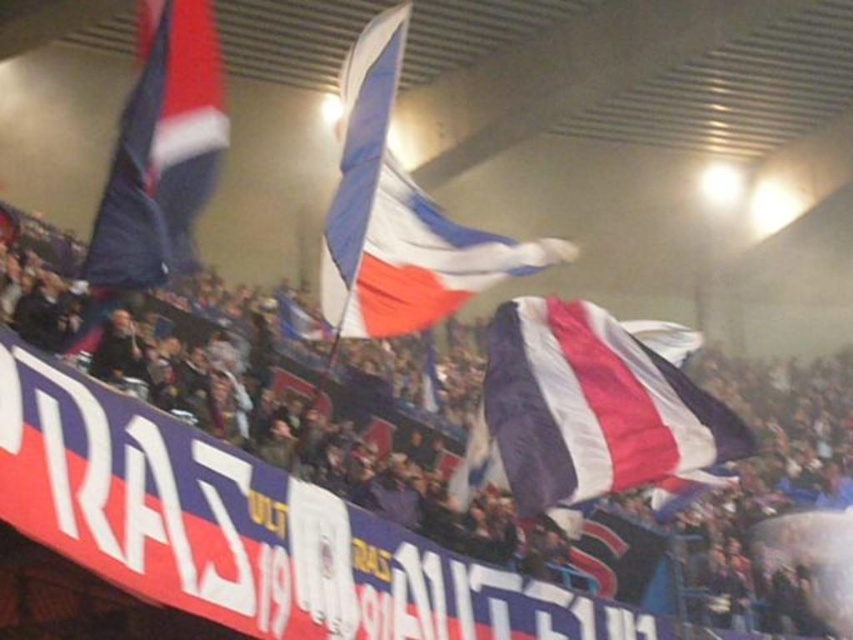
Is point (360, 189) farther from camera compared to point (119, 168)?

Yes, it is.

Does white fabric flag at center appear on the right side of red and white striped flag at upper left?

Indeed, white fabric flag at center is positioned on the right side of red and white striped flag at upper left.

Measure the distance between white fabric flag at center and camera.

white fabric flag at center and camera are 42.76 meters apart from each other.

You are a GUI agent. You are given a task and a screenshot of the screen. Output one action in this format:
    pyautogui.click(x=<x>, y=<y>)
    Task: Click on the white fabric flag at center
    The image size is (853, 640).
    Given the screenshot: What is the action you would take?
    pyautogui.click(x=399, y=216)

Which is in front, point (532, 609) or point (715, 472)?

Positioned in front is point (532, 609).

How far apart are textured fabric flags at center and matte fabric flag at center?

They are 11.18 meters apart.

Is point (384, 500) farther from camera compared to point (666, 406)?

That is True.

Where is `textured fabric flags at center`? This screenshot has width=853, height=640. textured fabric flags at center is located at coordinates (273, 528).

Consider the image. Who is positioned more to the left, textured fabric flags at center or white fabric flag at center?

Positioned to the left is white fabric flag at center.

Does point (109, 458) come closer to viewer compared to point (416, 301)?

Yes, it is in front of point (416, 301).

Locate an element on the screen. This screenshot has width=853, height=640. textured fabric flags at center is located at coordinates (273, 528).